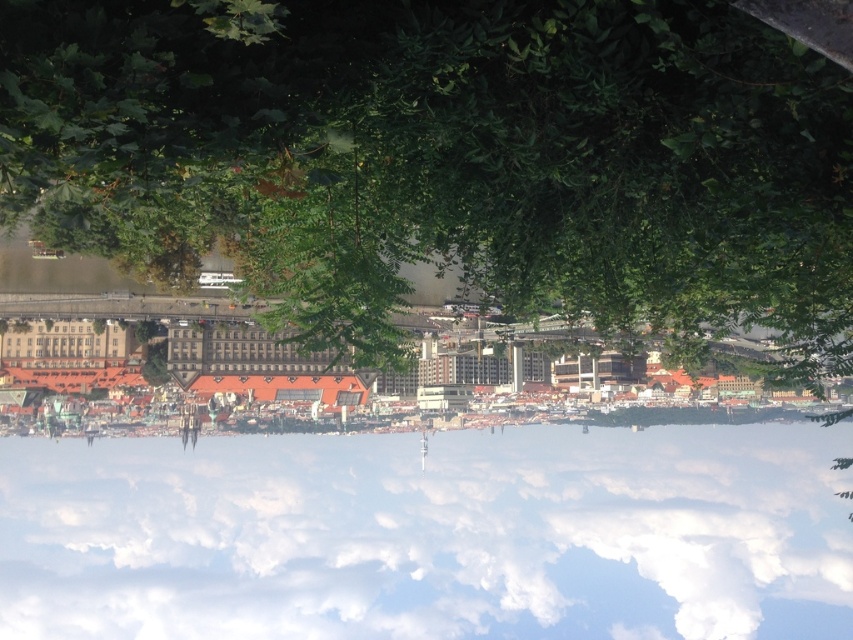
Question: Observing the image, what is the correct spatial positioning of white fluffy cloud at center in reference to brown stone buildings at center?

Choices:
 (A) left
 (B) right

Answer: (B)

Question: Does white fluffy cloud at center come in front of brown stone buildings at center?

Choices:
 (A) no
 (B) yes

Answer: (A)

Question: Which of the following is the closest to the observer?

Choices:
 (A) (527, 372)
 (B) (634, 616)

Answer: (A)

Question: Which of the following is the farthest from the observer?

Choices:
 (A) (503, 544)
 (B) (9, 360)

Answer: (A)

Question: Does white fluffy cloud at center have a larger size compared to brown stone buildings at center?

Choices:
 (A) no
 (B) yes

Answer: (B)